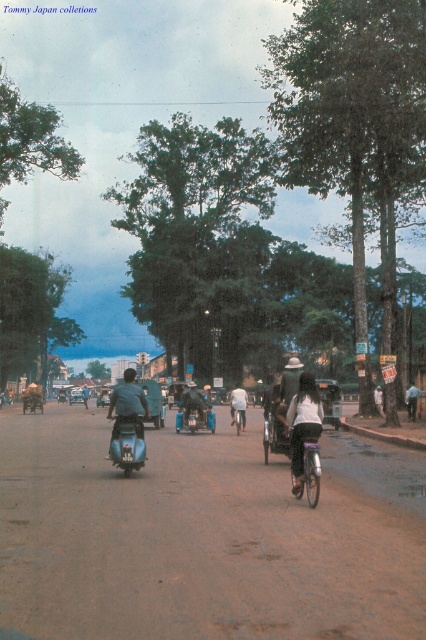
Looking at this image, which of these two, dark blue leather jacket at center or dark brown leather motorcycle at center, stands taller?

dark blue leather jacket at center is taller.

Is dark blue leather jacket at center taller than dark brown leather motorcycle at center?

Yes, dark blue leather jacket at center is taller than dark brown leather motorcycle at center.

Is point (140, 388) in front of point (203, 404)?

Yes.

Find the location of a particular element. dark blue leather jacket at center is located at coordinates (127, 404).

Describe the element at coordinates (193, 540) in the screenshot. This screenshot has height=640, width=426. I see `brown dirt track at center` at that location.

Can you confirm if brown dirt track at center is positioned above blue metallic motorcycle at center?

Incorrect, brown dirt track at center is not positioned above blue metallic motorcycle at center.

What do you see at coordinates (193, 540) in the screenshot? I see `brown dirt track at center` at bounding box center [193, 540].

You are a GUI agent. You are given a task and a screenshot of the screen. Output one action in this format:
    pyautogui.click(x=<x>, y=<y>)
    Task: Click on the brown dirt track at center
    This screenshot has width=426, height=640.
    Given the screenshot: What is the action you would take?
    pyautogui.click(x=193, y=540)

Locate an element on the screen. brown dirt track at center is located at coordinates (193, 540).

Can you confirm if brown dirt track at center is shorter than white matte person at center?

Yes.

Where is `brown dirt track at center`? This screenshot has width=426, height=640. brown dirt track at center is located at coordinates (193, 540).